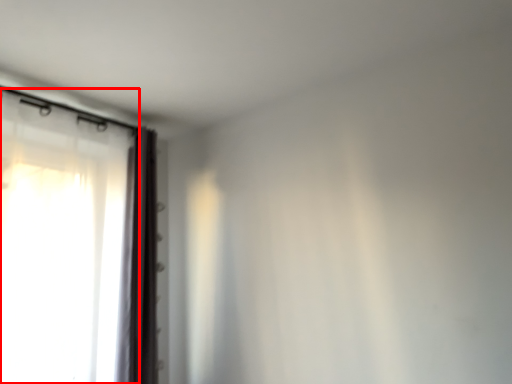
Question: Where is curtain (annotated by the red box) located in relation to curtain in the image?

Choices:
 (A) right
 (B) left

Answer: (B)